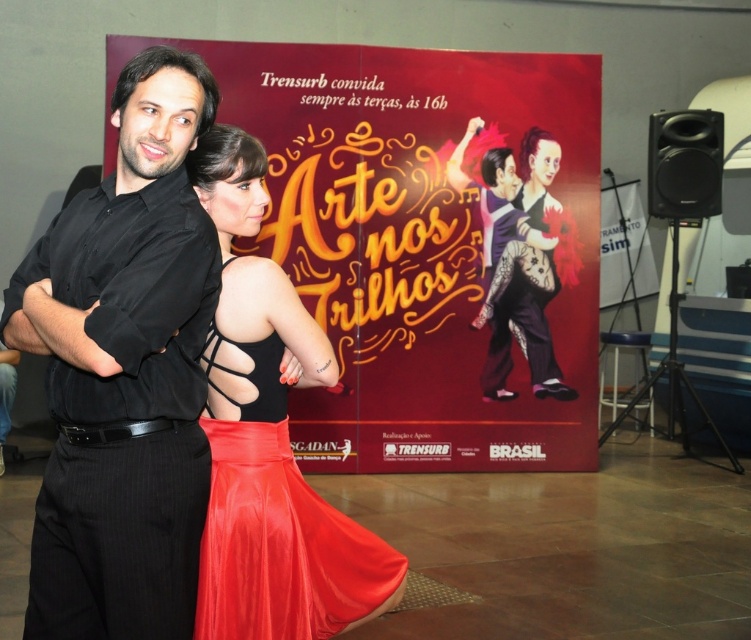
Question: Estimate the real-world distances between objects in this image. Which object is farther from the black pinstripe pants at left?

Choices:
 (A) satin red dress at center
 (B) smooth skin couple at center

Answer: (B)

Question: Can you confirm if black pinstripe pants at left is bigger than satin red dress at center?

Choices:
 (A) no
 (B) yes

Answer: (A)

Question: Does matte red poster at center come in front of black pinstripe pants at left?

Choices:
 (A) no
 (B) yes

Answer: (A)

Question: Can you confirm if matte red poster at center is positioned to the right of satin red dress at center?

Choices:
 (A) yes
 (B) no

Answer: (A)

Question: Which object is the farthest from the satin red dress at center?

Choices:
 (A) black pinstripe pants at left
 (B) matte red poster at center

Answer: (B)

Question: Based on their relative distances, which object is nearer to the satin red dress at center?

Choices:
 (A) smooth skin couple at center
 (B) black pinstripe pants at left

Answer: (B)